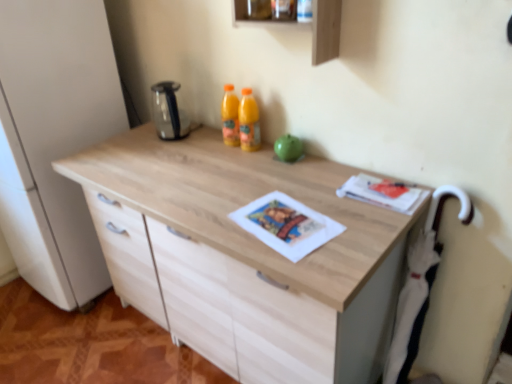
What do you see at coordinates (383, 193) in the screenshot? The height and width of the screenshot is (384, 512). I see `matte paper magazine at upper right` at bounding box center [383, 193].

What do you see at coordinates (298, 21) in the screenshot? I see `wooden shelf at upper center, the second shelf when ordered from top to bottom` at bounding box center [298, 21].

The width and height of the screenshot is (512, 384). I want to click on wooden frame at upper center, marked as the first shelf in a top-to-bottom arrangement, so pos(273,10).

Locate an element on the screen. This screenshot has height=384, width=512. stainless steel kettle at upper center is located at coordinates (168, 111).

Considering the sizes of objects wooden shelf at upper center, the second shelf when ordered from top to bottom, and wooden frame at upper center, marked as the first shelf in a top-to-bottom arrangement, in the image provided, who is smaller, wooden shelf at upper center, the second shelf when ordered from top to bottom, or wooden frame at upper center, marked as the first shelf in a top-to-bottom arrangement,?

With smaller size is wooden frame at upper center, marked as the first shelf in a top-to-bottom arrangement.

Does wooden shelf at upper center, the second shelf when ordered from top to bottom, come behind wooden frame at upper center, marked as the first shelf in a top-to-bottom arrangement?

No, it is in front of wooden frame at upper center, marked as the first shelf in a top-to-bottom arrangement.

Which point is more forward, (313, 27) or (283, 11)?

Point (313, 27)

Is wooden frame at upper center, positioned as the 2th shelf in bottom-to-top order, at the back of wooden shelf at upper center, acting as the 1th shelf starting from the bottom?

No.

Can you confirm if wooden shelf at upper center, acting as the 1th shelf starting from the bottom, is shorter than stainless steel kettle at upper center?

Indeed, wooden shelf at upper center, acting as the 1th shelf starting from the bottom, has a lesser height compared to stainless steel kettle at upper center.

In the scene shown: Which is in front, wooden shelf at upper center, acting as the 1th shelf starting from the bottom, or stainless steel kettle at upper center?

Positioned in front is wooden shelf at upper center, acting as the 1th shelf starting from the bottom.

Image resolution: width=512 pixels, height=384 pixels. What are the coordinates of `appliance that is under the wooden shelf at upper center, the second shelf when ordered from top to bottom (from a real-world perspective)` in the screenshot? It's located at (168, 111).

Looking at this image, which is correct: wooden shelf at upper center, acting as the 1th shelf starting from the bottom, is inside stainless steel kettle at upper center, or outside of it?

wooden shelf at upper center, acting as the 1th shelf starting from the bottom, is outside stainless steel kettle at upper center.

Is wooden shelf at upper center, the second shelf when ordered from top to bottom, in contact with matte paper magazine at upper right?

They are not placed beside each other.

Locate an element on the screen. This screenshot has width=512, height=384. magazine in front of the wooden shelf at upper center, acting as the 1th shelf starting from the bottom is located at coordinates click(x=383, y=193).

Is wooden shelf at upper center, acting as the 1th shelf starting from the bottom, shorter than matte paper magazine at upper right?

No, wooden shelf at upper center, acting as the 1th shelf starting from the bottom, is not shorter than matte paper magazine at upper right.

Between matte paper magazine at upper right and wooden frame at upper center, positioned as the 2th shelf in bottom-to-top order, which one appears on the left side from the viewer's perspective?

Positioned to the left is wooden frame at upper center, positioned as the 2th shelf in bottom-to-top order.

Choose the correct answer: Is matte paper magazine at upper right inside wooden frame at upper center, positioned as the 2th shelf in bottom-to-top order, or outside it?

matte paper magazine at upper right exists outside the volume of wooden frame at upper center, positioned as the 2th shelf in bottom-to-top order.

In the image, there is a wooden frame at upper center, positioned as the 2th shelf in bottom-to-top order. At what (x,y) coordinates should I click in order to perform the action: click on magazine below it (from the image's perspective). Please return your answer as a coordinate pair (x, y). The image size is (512, 384). Looking at the image, I should click on (383, 193).

Which of these two, matte paper magazine at upper right or wooden frame at upper center, positioned as the 2th shelf in bottom-to-top order, is thinner?

With smaller width is wooden frame at upper center, positioned as the 2th shelf in bottom-to-top order.

Can you confirm if matte paper magazine at upper right is bigger than stainless steel kettle at upper center?

Incorrect, matte paper magazine at upper right is not larger than stainless steel kettle at upper center.

Does matte paper magazine at upper right have a greater width compared to stainless steel kettle at upper center?

Correct, the width of matte paper magazine at upper right exceeds that of stainless steel kettle at upper center.

From the image's perspective, is matte paper magazine at upper right beneath stainless steel kettle at upper center?

Yes, from the image's perspective, matte paper magazine at upper right is below stainless steel kettle at upper center.

Which of these two, matte paper magazine at upper right or wooden shelf at upper center, the second shelf when ordered from top to bottom, is wider?

With larger width is matte paper magazine at upper right.

How different are the orientations of matte paper magazine at upper right and wooden shelf at upper center, acting as the 1th shelf starting from the bottom, in degrees?

The angle between the facing direction of matte paper magazine at upper right and the facing direction of wooden shelf at upper center, acting as the 1th shelf starting from the bottom, is 0.259 degrees.

From a real-world perspective, which shelf is the 1st one above the matte paper magazine at upper right? Please provide its 2D coordinates.

[(298, 21)]

Is wooden shelf at upper center, the second shelf when ordered from top to bottom, completely or partially inside matte paper magazine at upper right?

No, matte paper magazine at upper right does not contain wooden shelf at upper center, the second shelf when ordered from top to bottom.

In the image, is stainless steel kettle at upper center positioned in front of or behind wooden frame at upper center, marked as the first shelf in a top-to-bottom arrangement?

In the image, stainless steel kettle at upper center appears behind wooden frame at upper center, marked as the first shelf in a top-to-bottom arrangement.

Locate an element on the screen. This screenshot has height=384, width=512. appliance below the wooden frame at upper center, positioned as the 2th shelf in bottom-to-top order (from the image's perspective) is located at coordinates (168, 111).

Are stainless steel kettle at upper center and wooden frame at upper center, positioned as the 2th shelf in bottom-to-top order, located far from each other?

stainless steel kettle at upper center is actually quite close to wooden frame at upper center, positioned as the 2th shelf in bottom-to-top order.

Looking at the image, does stainless steel kettle at upper center seem bigger or smaller compared to wooden frame at upper center, marked as the first shelf in a top-to-bottom arrangement?

In the image, stainless steel kettle at upper center appears to be larger than wooden frame at upper center, marked as the first shelf in a top-to-bottom arrangement.

Where is `shelf that is on the left side of wooden shelf at upper center, the second shelf when ordered from top to bottom`? shelf that is on the left side of wooden shelf at upper center, the second shelf when ordered from top to bottom is located at coordinates (273, 10).

Locate an element on the screen. shelf that is the 2nd one when counting rightward from the stainless steel kettle at upper center is located at coordinates (298, 21).

When comparing their distances from stainless steel kettle at upper center, does wooden frame at upper center, marked as the first shelf in a top-to-bottom arrangement, or matte paper magazine at upper right seem further?

The object further to stainless steel kettle at upper center is matte paper magazine at upper right.

When comparing their distances from wooden shelf at upper center, acting as the 1th shelf starting from the bottom, does stainless steel kettle at upper center or matte paper magazine at upper right seem further?

stainless steel kettle at upper center is further to wooden shelf at upper center, acting as the 1th shelf starting from the bottom.

Considering their positions, is wooden shelf at upper center, acting as the 1th shelf starting from the bottom, positioned further to stainless steel kettle at upper center than wooden frame at upper center, marked as the first shelf in a top-to-bottom arrangement?

wooden shelf at upper center, acting as the 1th shelf starting from the bottom, is further to stainless steel kettle at upper center.

Looking at the image, which one is located further to wooden frame at upper center, marked as the first shelf in a top-to-bottom arrangement, matte paper magazine at upper right or wooden shelf at upper center, acting as the 1th shelf starting from the bottom?

matte paper magazine at upper right lies further to wooden frame at upper center, marked as the first shelf in a top-to-bottom arrangement, than the other object.

When comparing their distances from wooden shelf at upper center, the second shelf when ordered from top to bottom, does matte paper magazine at upper right or stainless steel kettle at upper center seem closer?

matte paper magazine at upper right is closer to wooden shelf at upper center, the second shelf when ordered from top to bottom.

Estimate the real-world distances between objects in this image. Which object is further from stainless steel kettle at upper center, wooden shelf at upper center, acting as the 1th shelf starting from the bottom, or matte paper magazine at upper right?

Among the two, matte paper magazine at upper right is located further to stainless steel kettle at upper center.

Looking at the image, which one is located closer to matte paper magazine at upper right, wooden frame at upper center, positioned as the 2th shelf in bottom-to-top order, or stainless steel kettle at upper center?

wooden frame at upper center, positioned as the 2th shelf in bottom-to-top order.

Estimate the real-world distances between objects in this image. Which object is further from stainless steel kettle at upper center, matte paper magazine at upper right or wooden shelf at upper center, the second shelf when ordered from top to bottom?

Based on the image, matte paper magazine at upper right appears to be further to stainless steel kettle at upper center.

You are a GUI agent. You are given a task and a screenshot of the screen. Output one action in this format:
    pyautogui.click(x=<x>, y=<y>)
    Task: Click on the shelf located between stainless steel kettle at upper center and wooden shelf at upper center, acting as the 1th shelf starting from the bottom, in the left-right direction
    
    Given the screenshot: What is the action you would take?
    pyautogui.click(x=273, y=10)

The image size is (512, 384). In order to click on shelf that lies between wooden frame at upper center, positioned as the 2th shelf in bottom-to-top order, and matte paper magazine at upper right from top to bottom in this screenshot , I will do `click(298, 21)`.